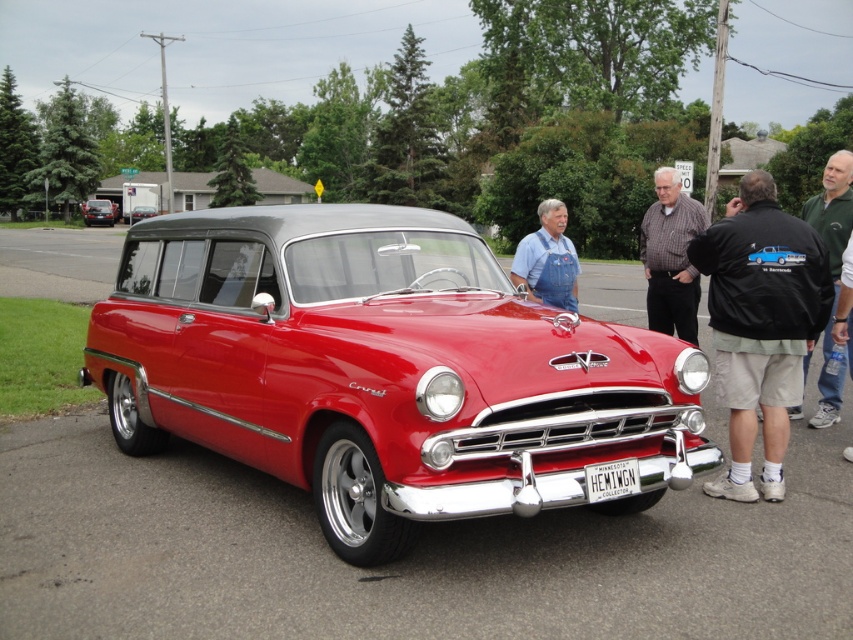
You are a photographer at a car show and want to take a photo of the shiny red car at center. However, there is a person wearing a black jacket at lower right blocking your view. Can you move to the left to capture the entire car without the jacket in the frame?

The shiny red car at center is positioned under the black jacket at lower right, so moving to the left might still keep the jacket in the frame. To ensure the jacket is out of view, you should move to the right side of the car instead.

You are a photographer at the car show and want to capture both the green cotton shirt at right and the green denim jacket at upper right in a single frame. Which of the two should you focus on first to ensure both are in the shot?

The green cotton shirt at right is to the right of the green denim jacket at upper right, so you should focus on the green denim jacket at upper right first to frame both objects properly.